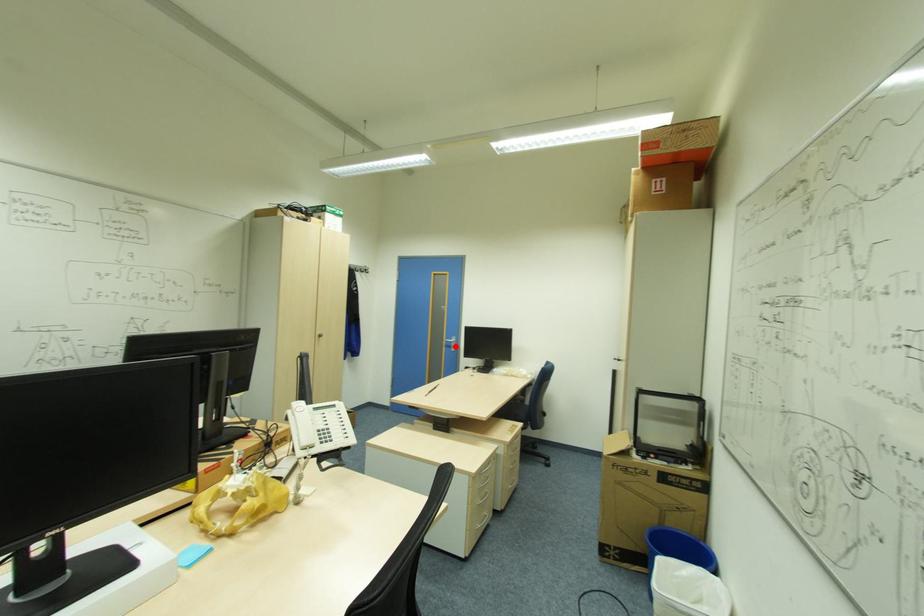
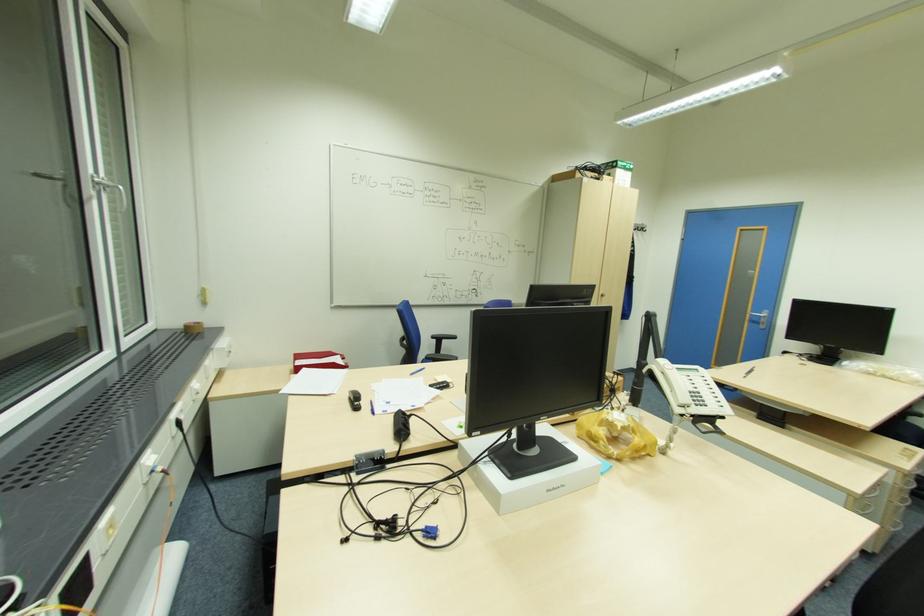
In the second image, find the point that corresponds to the highlighted location in the first image.

(766, 323)